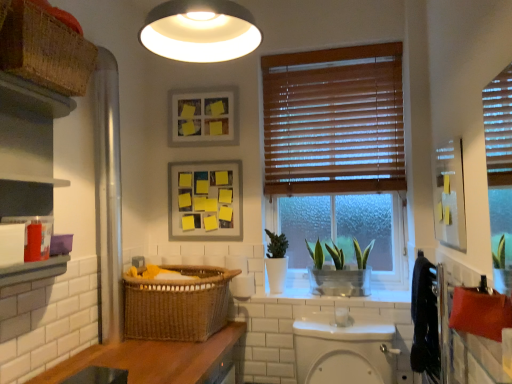
Question: Is white glossy toilet bowl at center far from yellow sticky notes on matte paper at upper center, which ranks as the 1th picture frame in bottom-to-top order?

Choices:
 (A) no
 (B) yes

Answer: (A)

Question: Can you confirm if white glossy toilet bowl at center is positioned to the left of yellow sticky notes on matte paper at upper center, which ranks as the 1th picture frame in bottom-to-top order?

Choices:
 (A) yes
 (B) no

Answer: (B)

Question: Is white glossy toilet bowl at center bigger than yellow sticky notes on matte paper at upper center, which ranks as the 1th picture frame in bottom-to-top order?

Choices:
 (A) no
 (B) yes

Answer: (B)

Question: Could you tell me if white glossy toilet bowl at center is turned towards yellow sticky notes on matte paper at upper center, arranged as the 2th picture frame when viewed from the top?

Choices:
 (A) no
 (B) yes

Answer: (A)

Question: Is white glossy toilet bowl at center smaller than yellow sticky notes on matte paper at upper center, arranged as the 2th picture frame when viewed from the top?

Choices:
 (A) yes
 (B) no

Answer: (B)

Question: Does white glossy toilet bowl at center have a greater height compared to yellow sticky notes on matte paper at upper center, arranged as the 2th picture frame when viewed from the top?

Choices:
 (A) yes
 (B) no

Answer: (B)

Question: Is white matte light fixture at upper center taller than wooden countertop at lower left?

Choices:
 (A) yes
 (B) no

Answer: (A)

Question: Is white matte light fixture at upper center not inside wooden countertop at lower left?

Choices:
 (A) yes
 (B) no

Answer: (A)

Question: Is the depth of white matte light fixture at upper center greater than that of wooden countertop at lower left?

Choices:
 (A) no
 (B) yes

Answer: (A)

Question: From a real-world perspective, is white matte light fixture at upper center under wooden countertop at lower left?

Choices:
 (A) yes
 (B) no

Answer: (B)

Question: Would you consider white matte light fixture at upper center to be distant from wooden countertop at lower left?

Choices:
 (A) yes
 (B) no

Answer: (A)

Question: From the image's perspective, is white matte light fixture at upper center under wooden countertop at lower left?

Choices:
 (A) yes
 (B) no

Answer: (B)

Question: Could you tell me if white matte light fixture at upper center is turned towards woven brown basket at lower left, which appears as the 1th basket when viewed from the right?

Choices:
 (A) no
 (B) yes

Answer: (A)